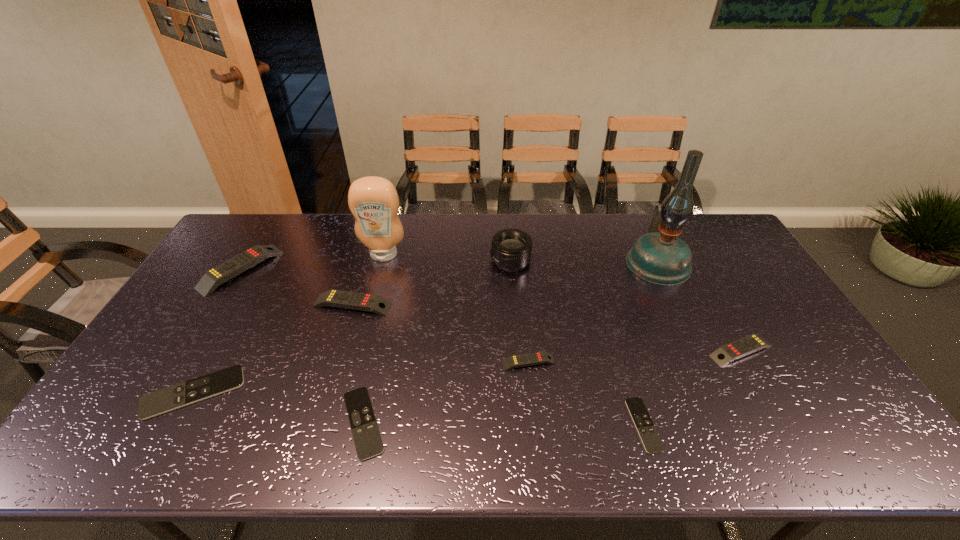
Image resolution: width=960 pixels, height=540 pixels. Find the location of `empty location between the third tallest remote control and the second yellow remote control from left to right`. empty location between the third tallest remote control and the second yellow remote control from left to right is located at coordinates (547, 328).

Image resolution: width=960 pixels, height=540 pixels. What are the coordinates of `vacant space that's between the shortest remote control and the seventh shortest object` in the screenshot? It's located at (443, 347).

Where is `free spot between the fourth shortest object and the rightmost remote control`? free spot between the fourth shortest object and the rightmost remote control is located at coordinates (635, 356).

Where is `vacant area that lies between the ninth shortest object and the fifth tallest remote control`? The width and height of the screenshot is (960, 540). vacant area that lies between the ninth shortest object and the fifth tallest remote control is located at coordinates (289, 324).

Find the location of `vacant space that's between the smallest black remote control and the seventh shortest object`. vacant space that's between the smallest black remote control and the seventh shortest object is located at coordinates (443, 347).

I want to click on free space between the third shortest object and the ninth shortest object, so (x=289, y=324).

This screenshot has height=540, width=960. Identify the location of vacant area between the fifth shortest remote control and the leftmost yellow remote control. (492, 310).

Identify the location of vacant point located between the leftmost black remote control and the shortest remote control. This screenshot has width=960, height=540. (419, 409).

This screenshot has width=960, height=540. I want to click on unoccupied area between the rightmost remote control and the rightmost black remote control, so click(x=692, y=388).

Locate an element on the screen. free space between the fifth shortest object and the sixth shortest remote control is located at coordinates (547, 328).